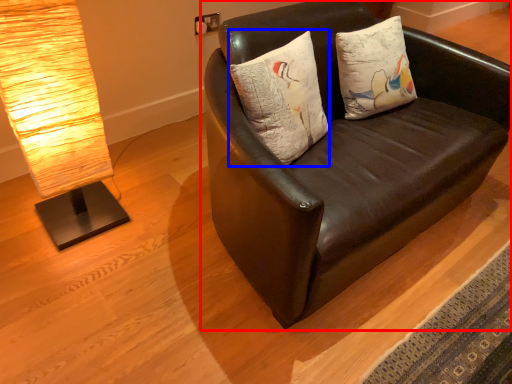
Question: Which point is closer to the camera, studio couch (highlighted by a red box) or pillow (highlighted by a blue box)?

Choices:
 (A) studio couch
 (B) pillow

Answer: (A)